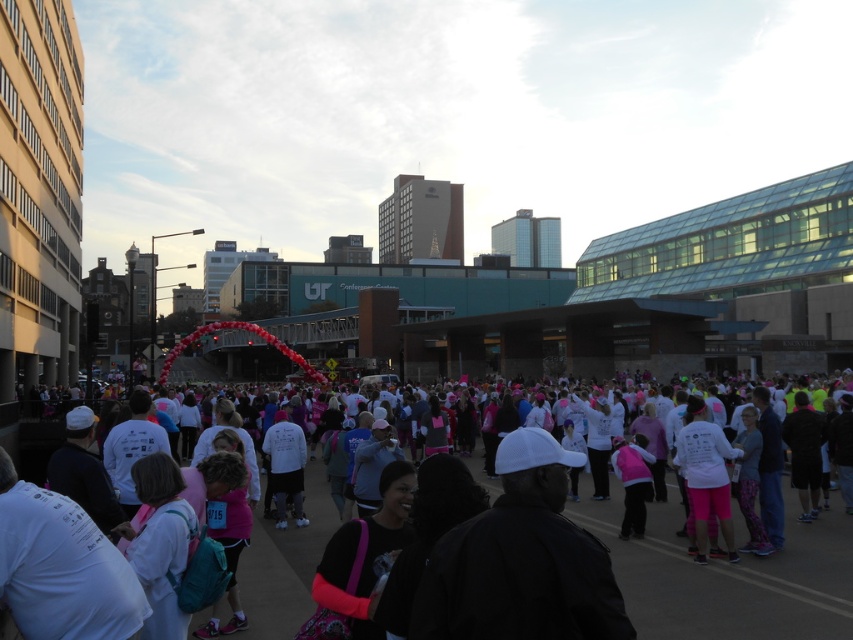
Question: Observing the image, what is the correct spatial positioning of white cotton shirts at center in reference to white matte t-shirt at center?

Choices:
 (A) right
 (B) left

Answer: (A)

Question: Which of these objects is positioned closest to the white matte t-shirt at center?

Choices:
 (A) white matte shirt at center
 (B) white cotton shirts at center

Answer: (B)

Question: Which of the following is the farthest from the observer?

Choices:
 (A) white matte shirt at center
 (B) white cotton shirts at center

Answer: (A)

Question: Can you confirm if white cotton shirts at center is smaller than white matte shirt at center?

Choices:
 (A) yes
 (B) no

Answer: (B)

Question: Which object is positioned farthest from the white cotton shirts at center?

Choices:
 (A) white matte shirt at center
 (B) white matte t-shirt at center

Answer: (A)

Question: In this image, where is white cotton shirts at center located relative to white matte shirt at center?

Choices:
 (A) above
 (B) below

Answer: (B)